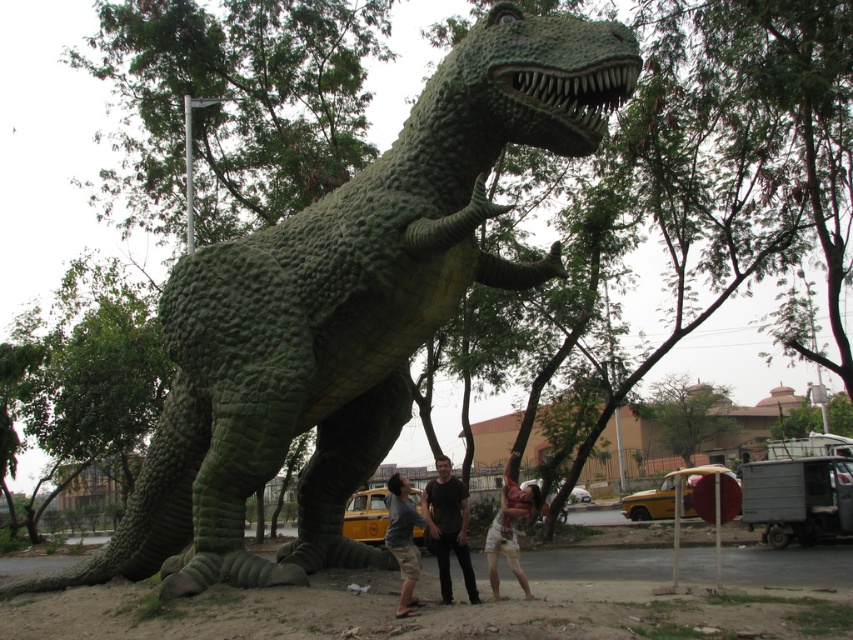
You are taking a photo of the green rough textured dinosaur at center and the light brown shorts at lower center. Which object is positioned to the right side of the photo?

The light brown shorts at lower center is positioned to the right side of the photo because the green rough textured dinosaur at center is to the left of it.

You are a photographer standing 10 feet away from the green rough textured dinosaur at center. You want to take a photo of the dark brown shirt at center without the dinosaur blocking it. Is it possible?

The distance between the green rough textured dinosaur at center and the dark brown shirt at center is 13.10 feet. Since you are 10 feet away from the dinosaur, the dark brown shirt at center is 3.1 feet behind the dinosaur. Therefore, the dinosaur would block the view of the dark brown shirt at center in the photo.

You are a photographer trying to capture a photo of the green rough textured dinosaur at center and the dark brown shirt at center. Based on their positions, can you determine which one is higher in the image?

The green rough textured dinosaur at center is above dark brown shirt at center, so the dinosaur is higher in the image.